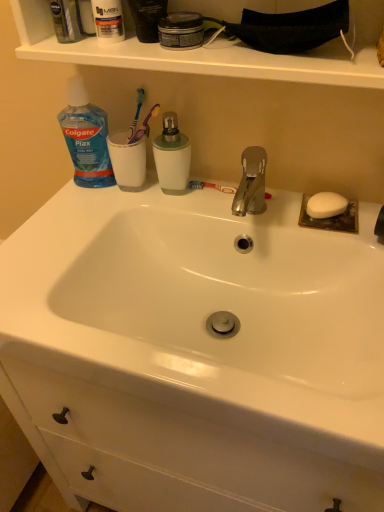
Locate an element on the screen. vacant space in front of blue translucent plastic bottle at upper left is located at coordinates (73, 221).